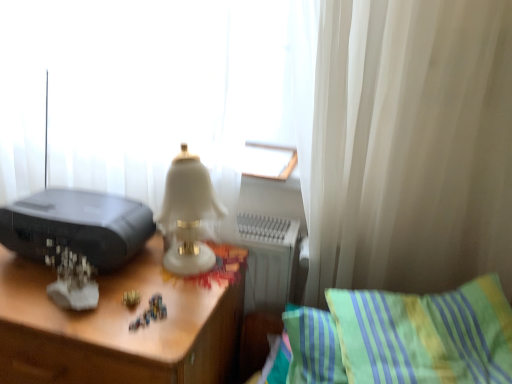
Question: Is the depth of black plastic printer at left greater than that of green striped pillow at lower right?

Choices:
 (A) yes
 (B) no

Answer: (A)

Question: Is black plastic printer at left not close to green striped pillow at lower right?

Choices:
 (A) yes
 (B) no

Answer: (B)

Question: Does black plastic printer at left have a smaller size compared to green striped pillow at lower right?

Choices:
 (A) no
 (B) yes

Answer: (B)

Question: Does black plastic printer at left have a lesser height compared to green striped pillow at lower right?

Choices:
 (A) no
 (B) yes

Answer: (B)

Question: Does black plastic printer at left have a lesser width compared to green striped pillow at lower right?

Choices:
 (A) yes
 (B) no

Answer: (A)

Question: Is wooden desk at center wider or thinner than black plastic printer at left?

Choices:
 (A) thin
 (B) wide

Answer: (B)

Question: In the image, is wooden desk at center positioned in front of or behind black plastic printer at left?

Choices:
 (A) behind
 (B) front

Answer: (B)

Question: From the image's perspective, is wooden desk at center above or below black plastic printer at left?

Choices:
 (A) below
 (B) above

Answer: (A)

Question: Which is correct: wooden desk at center is inside black plastic printer at left, or outside of it?

Choices:
 (A) inside
 (B) outside

Answer: (B)

Question: Is green striped pillow at lower right inside the boundaries of black plastic printer at left, or outside?

Choices:
 (A) outside
 (B) inside

Answer: (A)

Question: From a real-world perspective, is green striped pillow at lower right above or below black plastic printer at left?

Choices:
 (A) below
 (B) above

Answer: (A)

Question: Is green striped pillow at lower right bigger or smaller than black plastic printer at left?

Choices:
 (A) small
 (B) big

Answer: (B)

Question: In terms of height, does green striped pillow at lower right look taller or shorter compared to black plastic printer at left?

Choices:
 (A) short
 (B) tall

Answer: (B)

Question: From a real-world perspective, is wooden desk at center physically located above or below green striped pillow at lower right?

Choices:
 (A) above
 (B) below

Answer: (B)

Question: Would you say wooden desk at center is inside or outside green striped pillow at lower right?

Choices:
 (A) inside
 (B) outside

Answer: (B)